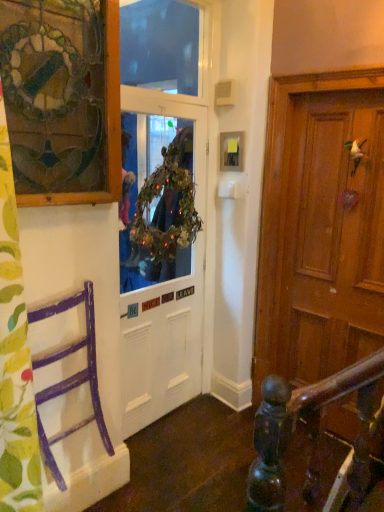
Question: Is green leafy wreath at center, marked as the second window screen in a top-to-bottom arrangement, wider than white matte door at center?

Choices:
 (A) yes
 (B) no

Answer: (A)

Question: Is the depth of green leafy wreath at center, the first window screen ordered from the bottom, less than that of white matte door at center?

Choices:
 (A) yes
 (B) no

Answer: (A)

Question: Is green leafy wreath at center, the first window screen ordered from the bottom, looking in the opposite direction of white matte door at center?

Choices:
 (A) no
 (B) yes

Answer: (B)

Question: Does green leafy wreath at center, marked as the second window screen in a top-to-bottom arrangement, have a lesser height compared to white matte door at center?

Choices:
 (A) yes
 (B) no

Answer: (A)

Question: Can you confirm if green leafy wreath at center, the first window screen ordered from the bottom, is thinner than white matte door at center?

Choices:
 (A) no
 (B) yes

Answer: (A)

Question: In the image, is transparent plastic window screen at upper center, which is the first window screen from top to bottom, positioned in front of or behind wooden picture frame at upper center, which ranks as the 1th picture frame in right-to-left order?

Choices:
 (A) behind
 (B) front

Answer: (B)

Question: Considering the positions of transparent plastic window screen at upper center, the second window screen positioned from the bottom, and wooden picture frame at upper center, which ranks as the 1th picture frame in right-to-left order, in the image, is transparent plastic window screen at upper center, the second window screen positioned from the bottom, wider or thinner than wooden picture frame at upper center, which ranks as the 1th picture frame in right-to-left order,?

Choices:
 (A) wide
 (B) thin

Answer: (A)

Question: Is point (167, 19) closer or farther from the camera than point (221, 145)?

Choices:
 (A) closer
 (B) farther

Answer: (B)

Question: Would you say transparent plastic window screen at upper center, the second window screen positioned from the bottom, is to the left or to the right of wooden picture frame at upper center, the 1th picture frame in the back-to-front sequence, in the picture?

Choices:
 (A) right
 (B) left

Answer: (B)

Question: Based on their sizes in the image, would you say purple painted wood chair at left is bigger or smaller than white matte door at center?

Choices:
 (A) big
 (B) small

Answer: (B)

Question: In terms of width, does purple painted wood chair at left look wider or thinner when compared to white matte door at center?

Choices:
 (A) thin
 (B) wide

Answer: (B)

Question: Is point (79, 347) closer or farther from the camera than point (175, 272)?

Choices:
 (A) farther
 (B) closer

Answer: (B)

Question: Which is correct: purple painted wood chair at left is inside white matte door at center, or outside of it?

Choices:
 (A) outside
 (B) inside

Answer: (A)

Question: Looking at their shapes, would you say wooden picture frame at upper center, which is counted as the 2th picture frame, starting from the left, is wider or thinner than green leafy wreath at center, marked as the second window screen in a top-to-bottom arrangement?

Choices:
 (A) thin
 (B) wide

Answer: (A)

Question: From a real-world perspective, is wooden picture frame at upper center, which is counted as the 2th picture frame, starting from the left, above or below green leafy wreath at center, marked as the second window screen in a top-to-bottom arrangement?

Choices:
 (A) above
 (B) below

Answer: (A)